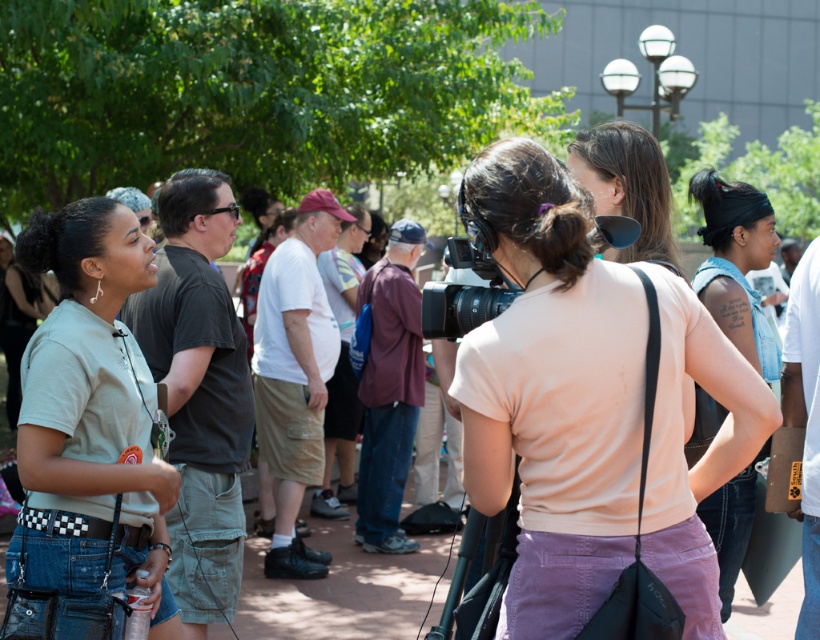
Consider the image. Does denim shorts at left appear under light pink cotton shirt at center?

Correct, denim shorts at left is located below light pink cotton shirt at center.

Which is above, denim shorts at left or light pink cotton shirt at center?

Positioned higher is light pink cotton shirt at center.

This screenshot has width=820, height=640. I want to click on denim shorts at left, so click(90, 413).

Who is more forward, (x=615, y=378) or (x=438, y=292)?

Point (x=615, y=378) is in front.

Is matte pink shirt at center positioned at the back of matte black video camera at center?

No, matte pink shirt at center is in front of matte black video camera at center.

I want to click on matte pink shirt at center, so click(x=552, y=392).

At what (x,y) coordinates should I click in order to perform the action: click on matte pink shirt at center. Please return your answer as a coordinate pair (x, y). Looking at the image, I should click on (552, 392).

Who is taller, denim shorts at left or matte black video camera at center?

With more height is denim shorts at left.

Can you confirm if denim shorts at left is shorter than matte black video camera at center?

Incorrect, denim shorts at left's height does not fall short of matte black video camera at center's.

Does point (144, 512) come in front of point (477, 285)?

Yes, it is.

Where is `denim shorts at left`? The width and height of the screenshot is (820, 640). denim shorts at left is located at coordinates (90, 413).